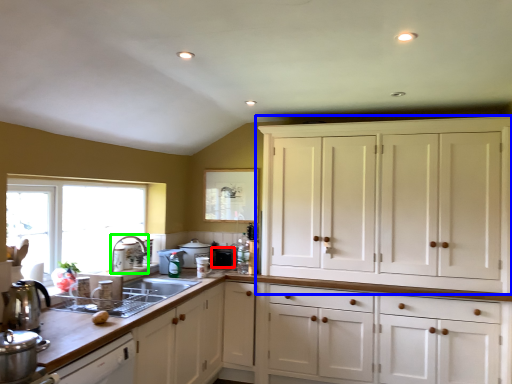
Question: Considering the real-world distances, which object is farthest from appliance (highlighted by a red box)? cabinetry (highlighted by a blue box) or faucet (highlighted by a green box)?

Choices:
 (A) cabinetry
 (B) faucet

Answer: (A)